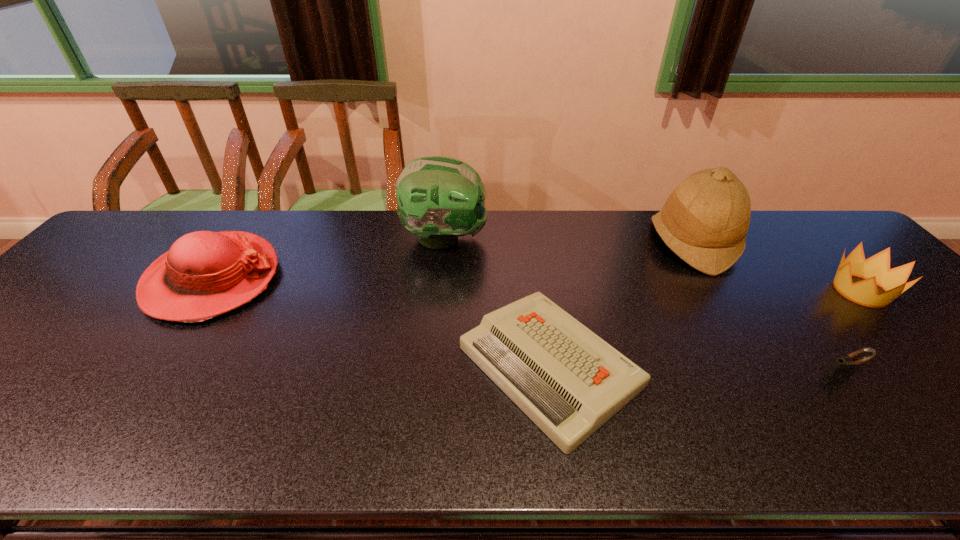
Identify the location of empty location between the right hat and the shorter hat. (452, 261).

Locate which object ranks second in proximity to the crown. Please provide its 2D coordinates. Your answer should be formatted as a tuple, i.e. [(x, y)], where the tuple contains the x and y coordinates of a point satisfying the conditions above.

[(841, 367)]

Identify which object is the fifth nearest to the shorter hat. Please provide its 2D coordinates. Your answer should be formatted as a tuple, i.e. [(x, y)], where the tuple contains the x and y coordinates of a point satisfying the conditions above.

[(875, 270)]

You are a GUI agent. You are given a task and a screenshot of the screen. Output one action in this format:
    pyautogui.click(x=<x>, y=<y>)
    Task: Click on the free space that satisfies the following two spatial constraints: 1. on the back side of the third shortest object; 2. on the visor of the football helmet
    The image size is (960, 540).
    Given the screenshot: What is the action you would take?
    pyautogui.click(x=810, y=238)

Find the location of a particular element. The image size is (960, 540). free location that satisfies the following two spatial constraints: 1. on the back side of the rightmost object; 2. on the front-facing side of the taller hat is located at coordinates (815, 242).

Where is `free point that satisfies the following two spatial constraints: 1. on the visor of the football helmet; 2. on the back side of the rightmost object`? This screenshot has height=540, width=960. free point that satisfies the following two spatial constraints: 1. on the visor of the football helmet; 2. on the back side of the rightmost object is located at coordinates (440, 291).